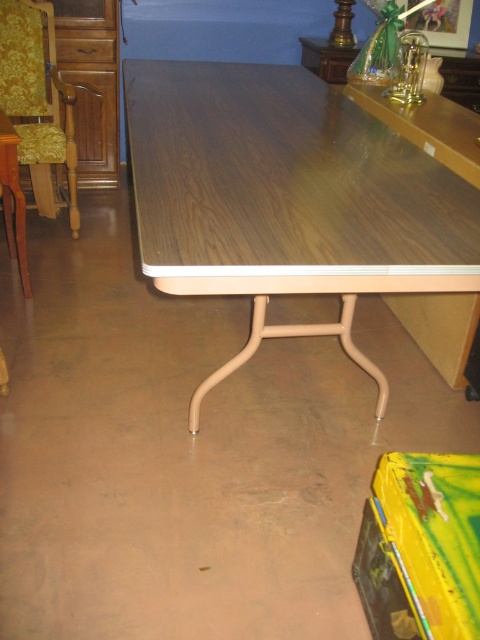
Can you confirm if wooden table at center is taller than gold-patterned fabric armchair at upper left?

Yes, wooden table at center is taller than gold-patterned fabric armchair at upper left.

Is point (237, 209) less distant than point (17, 68)?

That is True.

At what (x,y) coordinates should I click in order to perform the action: click on wooden table at center. Please return your answer as a coordinate pair (x, y). Looking at the image, I should click on (287, 198).